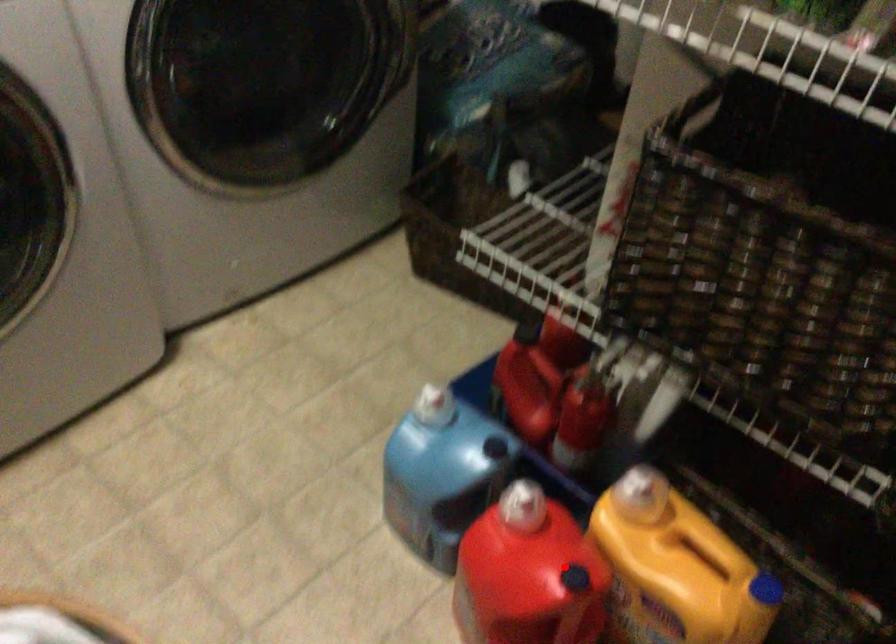
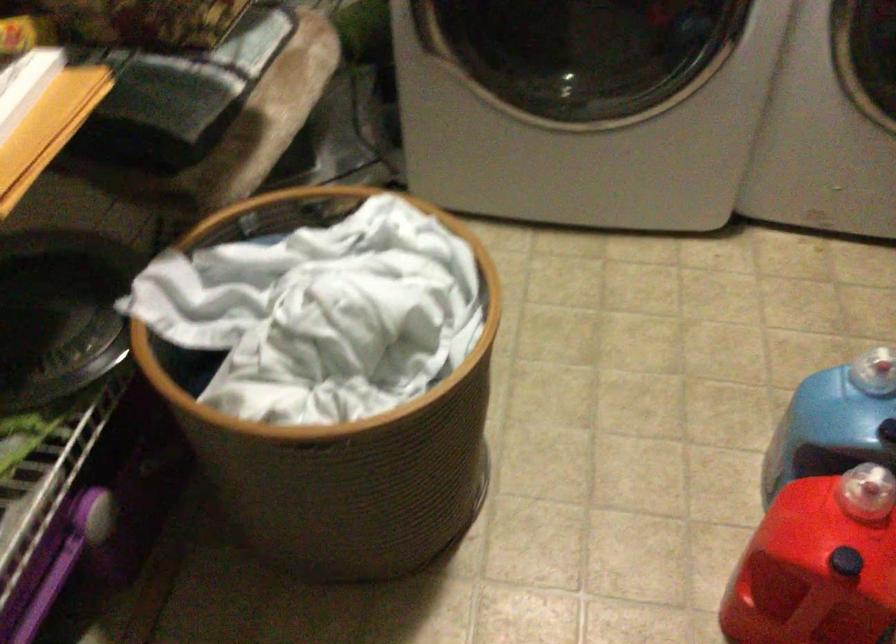
Locate, in the second image, the point that corresponds to the highlighted location in the first image.

(846, 562)